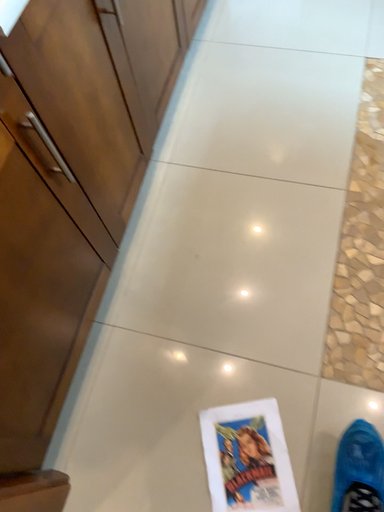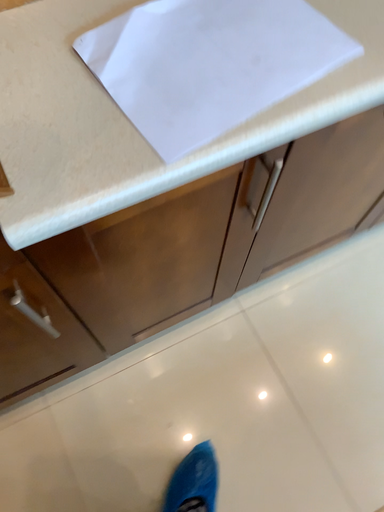
Question: Which way did the camera rotate in the video?

Choices:
 (A) rotated left
 (B) rotated right

Answer: (A)